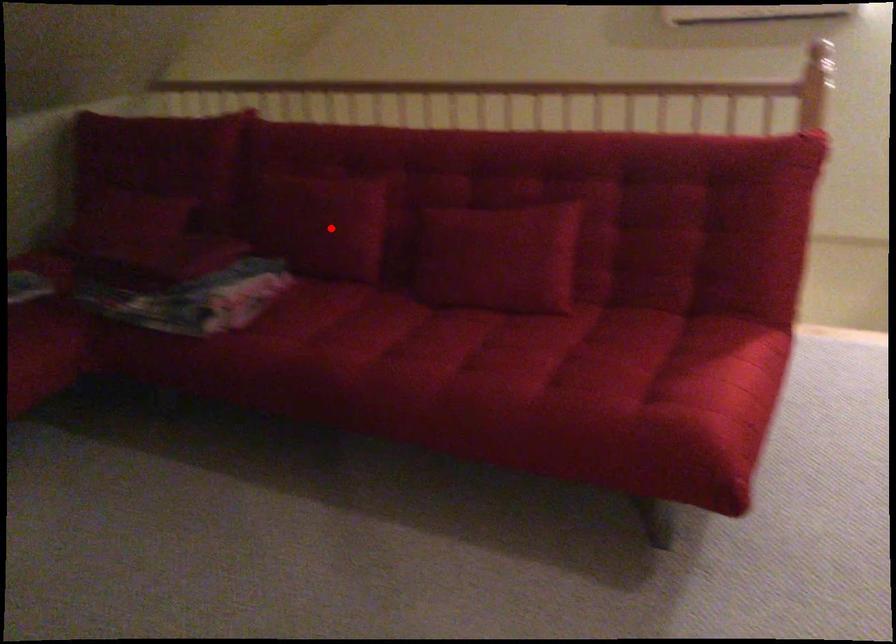
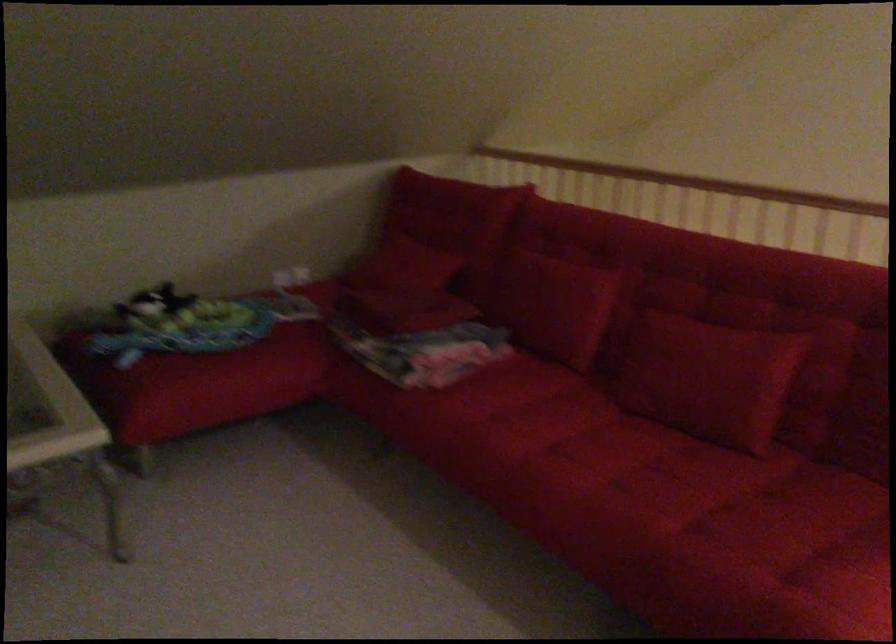
In the second image, find the point that corresponds to the highlighted location in the first image.

(555, 306)